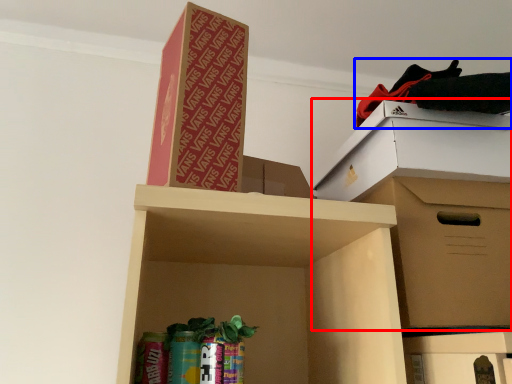
Question: Which object is further to the camera taking this photo, cardboard box (highlighted by a red box) or clothing (highlighted by a blue box)?

Choices:
 (A) cardboard box
 (B) clothing

Answer: (B)